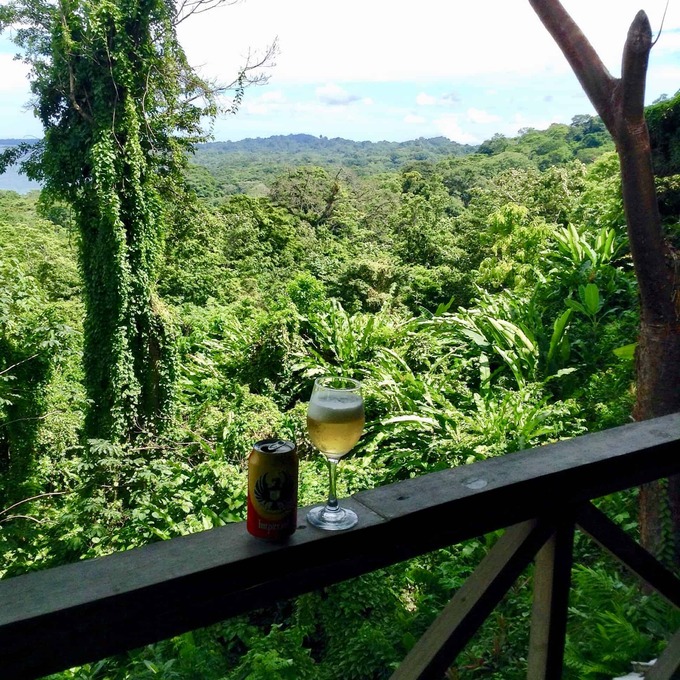
Find the location of a particular element. This screenshot has height=680, width=680. wine glass is located at coordinates (343, 392).